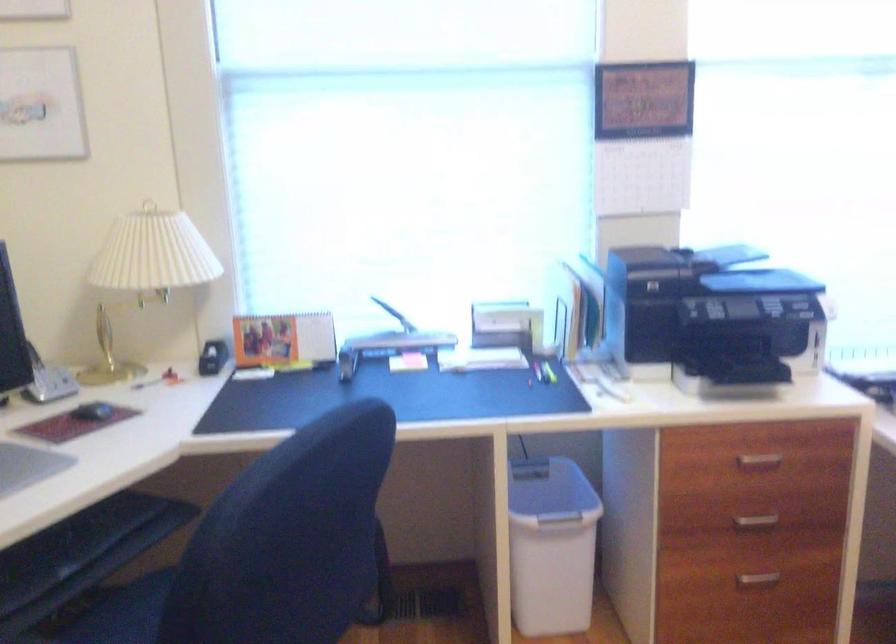
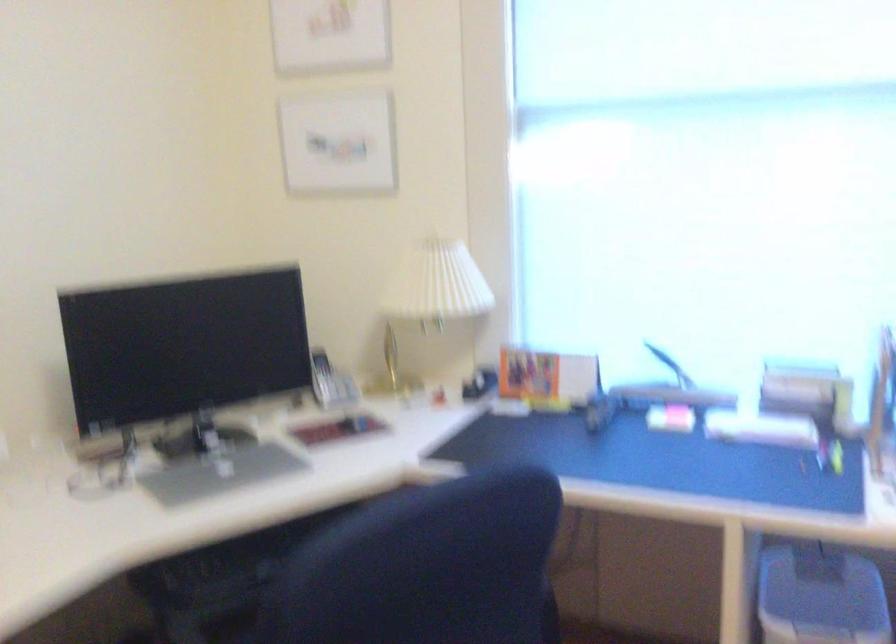
Find the pixel in the second image that matches (211,355) in the first image.

(479, 383)